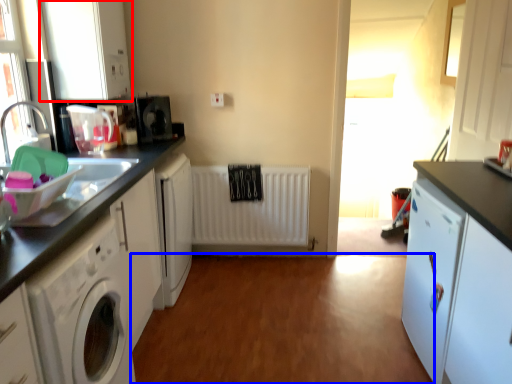
Question: Which object is further to the camera taking this photo, cabinetry (highlighted by a red box) or plain (highlighted by a blue box)?

Choices:
 (A) cabinetry
 (B) plain

Answer: (A)